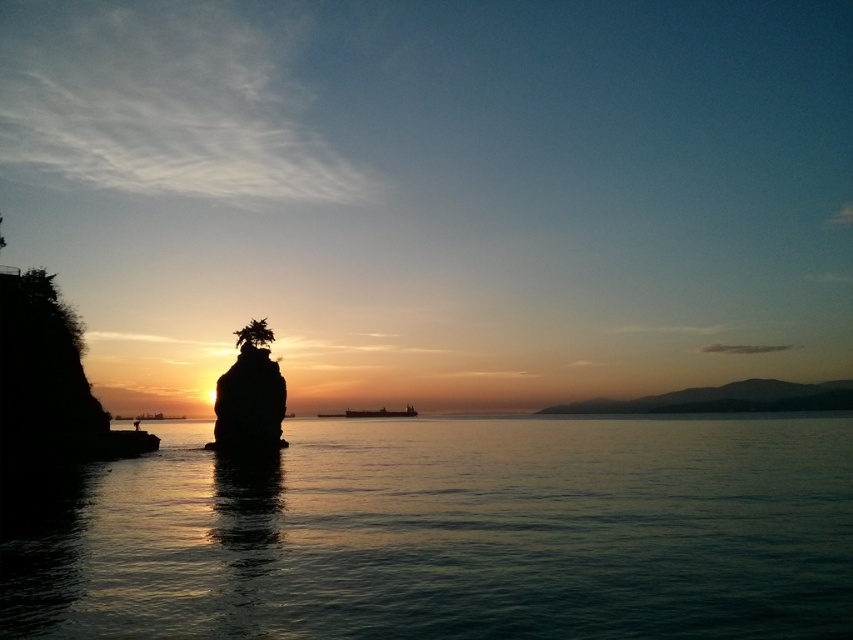
Looking at this image, does transparent water at center have a lesser height compared to silhouette stone at center?

No.

Is transparent water at center positioned at the back of silhouette stone at center?

No, transparent water at center is in front of silhouette stone at center.

Does point (321, 513) come in front of point (236, 413)?

Yes.

At what (x,y) coordinates should I click in order to perform the action: click on transparent water at center. Please return your answer as a coordinate pair (x, y). This screenshot has height=640, width=853. Looking at the image, I should click on (451, 534).

Who is more distant from viewer, (224, 380) or (369, 417)?

The point (369, 417) is behind.

Does silhouette stone at center have a larger size compared to metallic gray ship at center?

Actually, silhouette stone at center might be smaller than metallic gray ship at center.

The image size is (853, 640). In order to click on silhouette stone at center in this screenshot , I will do `click(248, 396)`.

Locate an element on the screen. The width and height of the screenshot is (853, 640). silhouette stone at center is located at coordinates (248, 396).

Can you confirm if transparent water at center is shorter than metallic gray ship at center?

Incorrect, transparent water at center's height does not fall short of metallic gray ship at center's.

Locate an element on the screen. The height and width of the screenshot is (640, 853). transparent water at center is located at coordinates (451, 534).